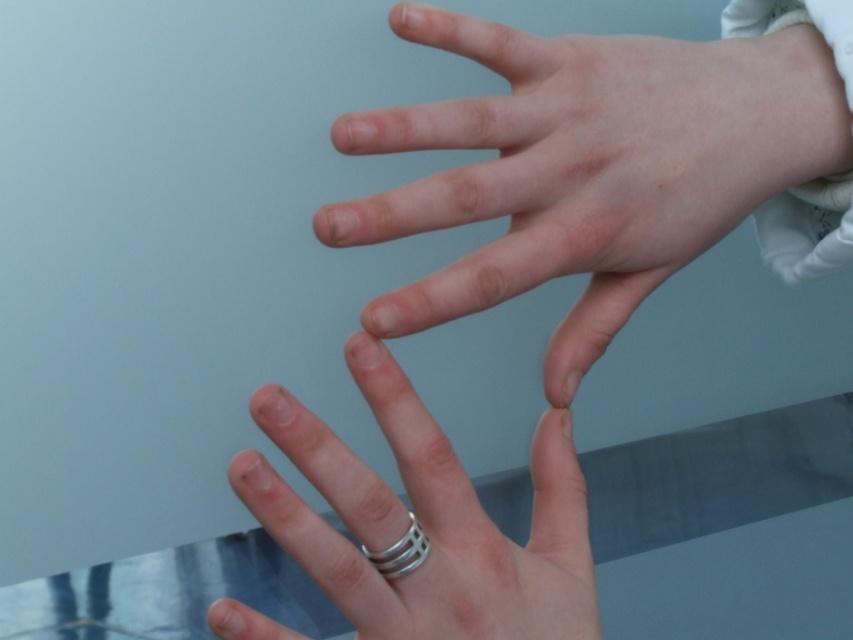
Question: Is transparent glass table at lower center further to the viewer compared to silver metallic ring at lower center?

Choices:
 (A) yes
 (B) no

Answer: (A)

Question: Which is farther from the silver metallic ring at lower center?

Choices:
 (A) silver metallic ring at center
 (B) transparent glass table at lower center

Answer: (B)

Question: Does silver metallic ring at center appear on the right side of silver metallic ring at lower center?

Choices:
 (A) no
 (B) yes

Answer: (B)

Question: Which point is farther to the camera?

Choices:
 (A) (376, 566)
 (B) (422, 291)
 (C) (561, 561)

Answer: (C)

Question: Is transparent glass table at lower center to the left of silver metallic ring at lower center from the viewer's perspective?

Choices:
 (A) no
 (B) yes

Answer: (A)

Question: Which of these objects is positioned closest to the silver metallic ring at center?

Choices:
 (A) transparent glass table at lower center
 (B) silver metallic ring at lower center
 (C) pale skin hand at center

Answer: (B)